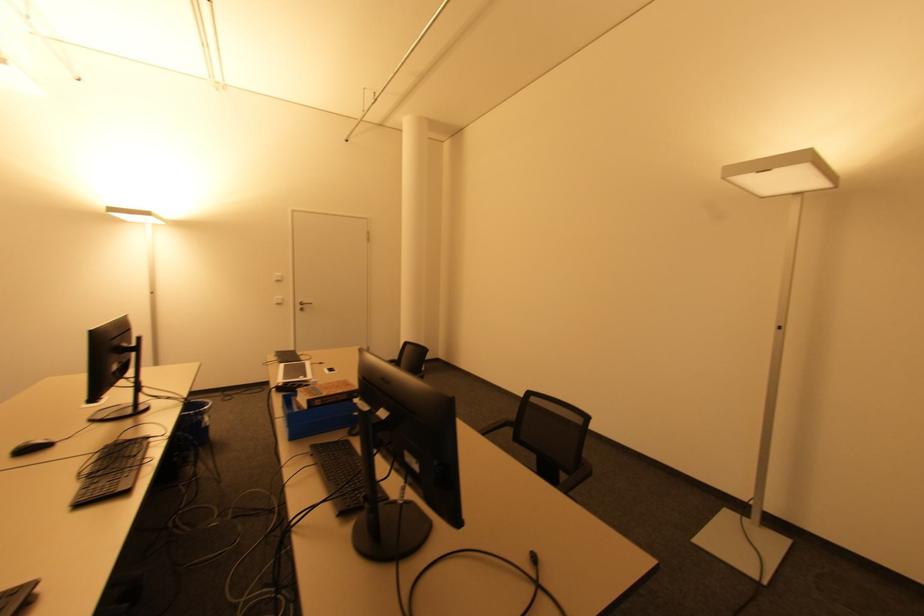
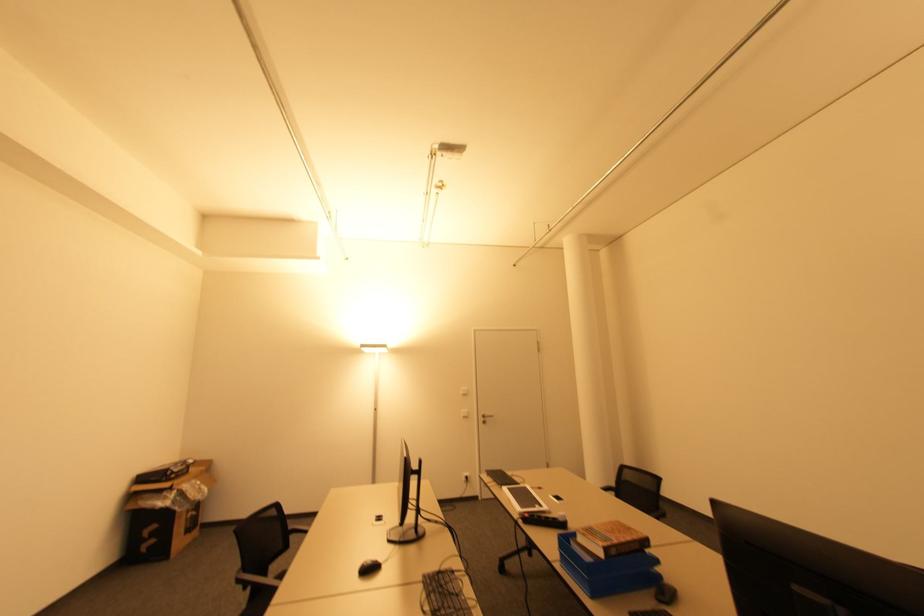
Question: What movement of the cameraman would produce the second image?

Choices:
 (A) Left
 (B) Right
 (C) Forward
 (D) Backward

Answer: (A)